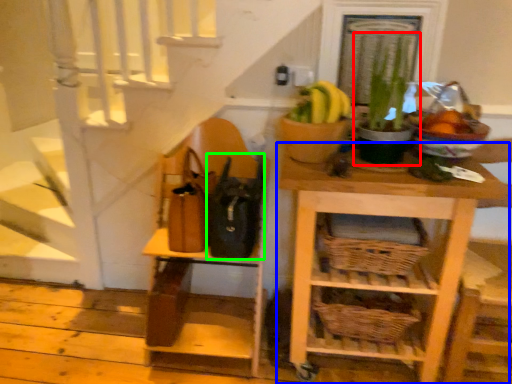
Question: Which is nearer to the houseplant (highlighted by a red box)? shelf (highlighted by a blue box) or bag (highlighted by a green box).

Choices:
 (A) shelf
 (B) bag

Answer: (A)